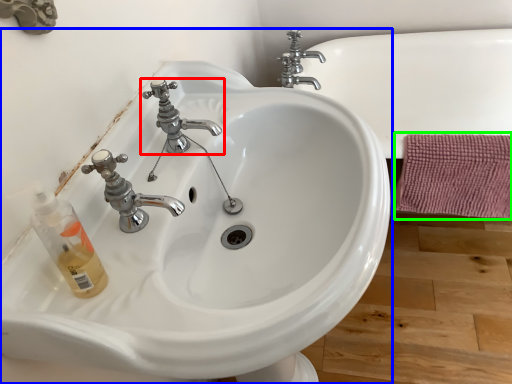
Question: Estimate the real-world distances between objects in this image. Which object is closer to tap (highlighted by a red box), sink (highlighted by a blue box) or bath towel (highlighted by a green box)?

Choices:
 (A) sink
 (B) bath towel

Answer: (A)